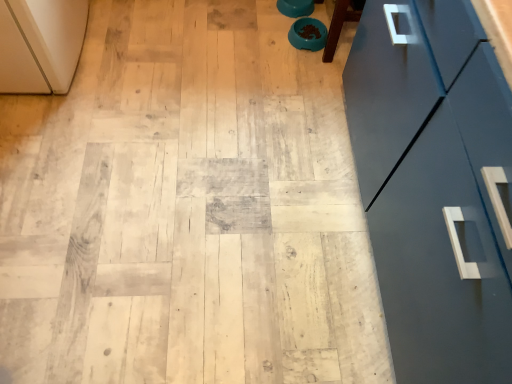
What do you see at coordinates (435, 186) in the screenshot? I see `glossy dark blue cabinet at right` at bounding box center [435, 186].

The width and height of the screenshot is (512, 384). I want to click on glossy dark blue cabinet at right, so click(x=435, y=186).

Where is `glossy dark blue cabinet at right`? Image resolution: width=512 pixels, height=384 pixels. glossy dark blue cabinet at right is located at coordinates tap(435, 186).